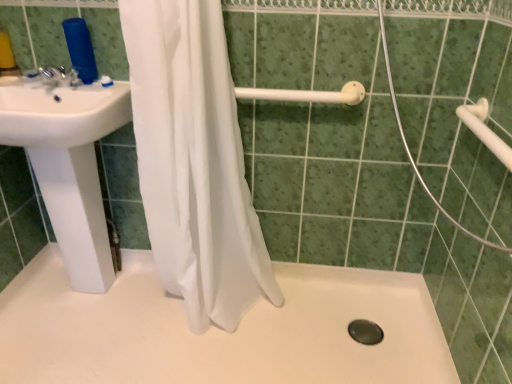
The image size is (512, 384). Find the location of `free space in front of black rubber drain at bottom center`. free space in front of black rubber drain at bottom center is located at coordinates (369, 363).